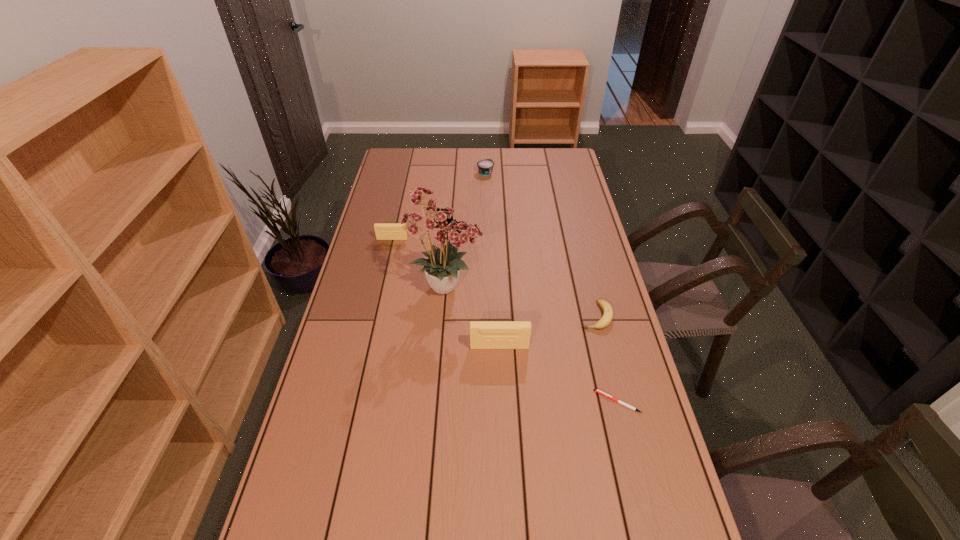
Identify the location of free space between the second shortest object and the tallest object. (521, 301).

Find the location of a particular element. Image resolution: width=960 pixels, height=540 pixels. unoccupied position between the taller videotape and the second shortest object is located at coordinates (547, 331).

Where is `empty space that is in between the third shortest object and the taller videotape`? The height and width of the screenshot is (540, 960). empty space that is in between the third shortest object and the taller videotape is located at coordinates (492, 259).

Identify the location of empty space that is in between the farther videotape and the nearest object. The height and width of the screenshot is (540, 960). (505, 320).

Find the location of a particular element. The image size is (960, 540). blank region between the banana and the yogurt is located at coordinates (540, 244).

The image size is (960, 540). I want to click on object that ranks as the closest to the farther videotape, so click(439, 225).

Find the location of a particular element. The image size is (960, 540). the closest object relative to the shorter videotape is located at coordinates (439, 225).